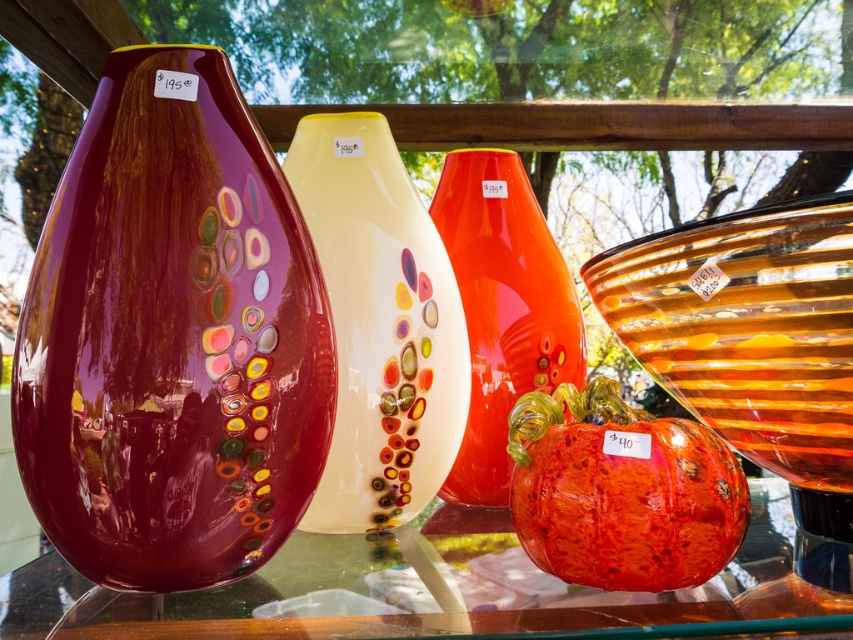
Which is more to the right, translucent white vase at center or glossy glass vase at center?

From the viewer's perspective, glossy glass vase at center appears more on the right side.

Does translucent white vase at center appear on the right side of glossy glass vase at center?

No, translucent white vase at center is not to the right of glossy glass vase at center.

Between point (376, 144) and point (480, 289), which one is positioned in front?

Point (376, 144) is more forward.

Where is `translucent white vase at center`? translucent white vase at center is located at coordinates [x=380, y=324].

Does glossy glass vase at left have a lesser width compared to translucent white vase at center?

No, glossy glass vase at left is not thinner than translucent white vase at center.

Is point (195, 168) behind point (358, 492)?

That is False.

Where is `glossy glass vase at left`? Image resolution: width=853 pixels, height=640 pixels. glossy glass vase at left is located at coordinates (171, 337).

Does translucent amber glass bowl at right have a smaller size compared to transparent glass table at center?

Incorrect, translucent amber glass bowl at right is not smaller in size than transparent glass table at center.

Which is in front, point (637, 276) or point (6, 621)?

Point (6, 621) is in front.

Does point (817, 595) come in front of point (341, 580)?

Yes, it is in front of point (341, 580).

Find the location of a particular element. Image resolution: width=853 pixels, height=640 pixels. translucent amber glass bowl at right is located at coordinates (757, 362).